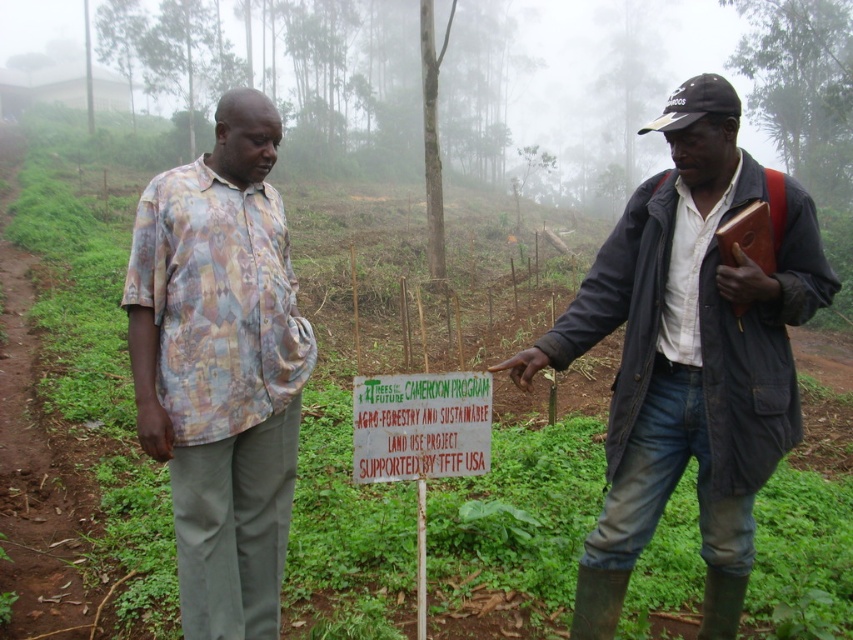
Is point (537, 356) positioned in front of point (373, 481)?

No, (537, 356) is further to viewer.

Can you confirm if dark blue jacket at center is positioned to the left of green wooden sign at center?

No, dark blue jacket at center is not to the left of green wooden sign at center.

Between point (729, 548) and point (354, 401), which one is positioned in front?

Positioned in front is point (354, 401).

Identify the location of dark blue jacket at center. The image size is (853, 640). (689, 355).

Is dark blue jacket at center shorter than green painted wood sign at center?

Incorrect, dark blue jacket at center's height does not fall short of green painted wood sign at center's.

Between point (755, 417) and point (480, 385), which one is positioned in front?

Point (755, 417) is in front.

At what (x,y) coordinates should I click in order to perform the action: click on dark blue jacket at center. Please return your answer as a coordinate pair (x, y). Image resolution: width=853 pixels, height=640 pixels. Looking at the image, I should click on (689, 355).

Is point (270, 403) farther from camera compared to point (451, 444)?

Yes.

Does point (231, 92) lie in front of point (447, 419)?

No, (231, 92) is further to viewer.

This screenshot has height=640, width=853. What are the coordinates of `printed fabric shirt at left` in the screenshot? It's located at (221, 368).